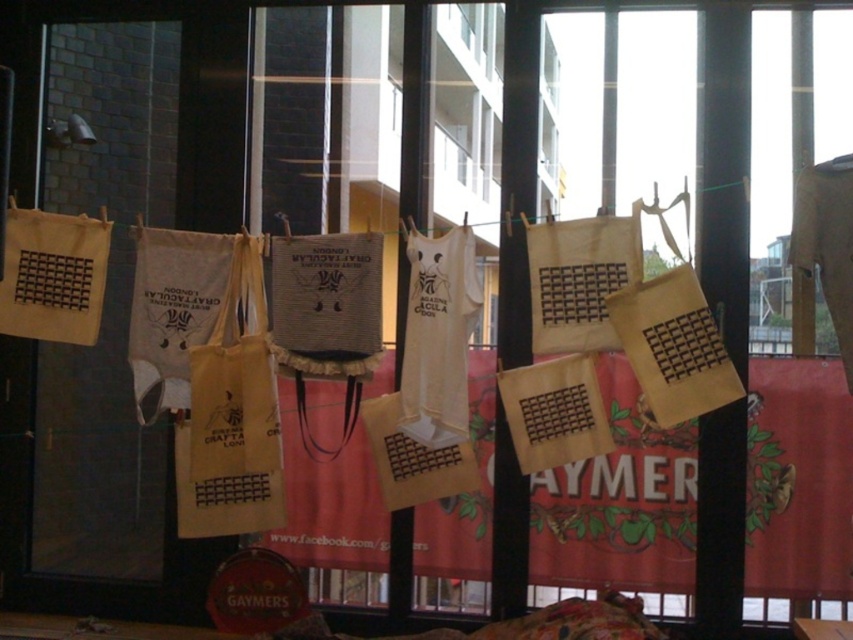
You are taking a photo of the handmade items display. You want to focus on the point at point (190, 513) and point (456, 275). Which point should you adjust your camera focus to first to ensure both are in focus?

You should focus on point (190, 513) first because it is closer to the camera than point (456, 275). By focusing on the closer point, the farther point will also be in focus if the depth of field is sufficient.